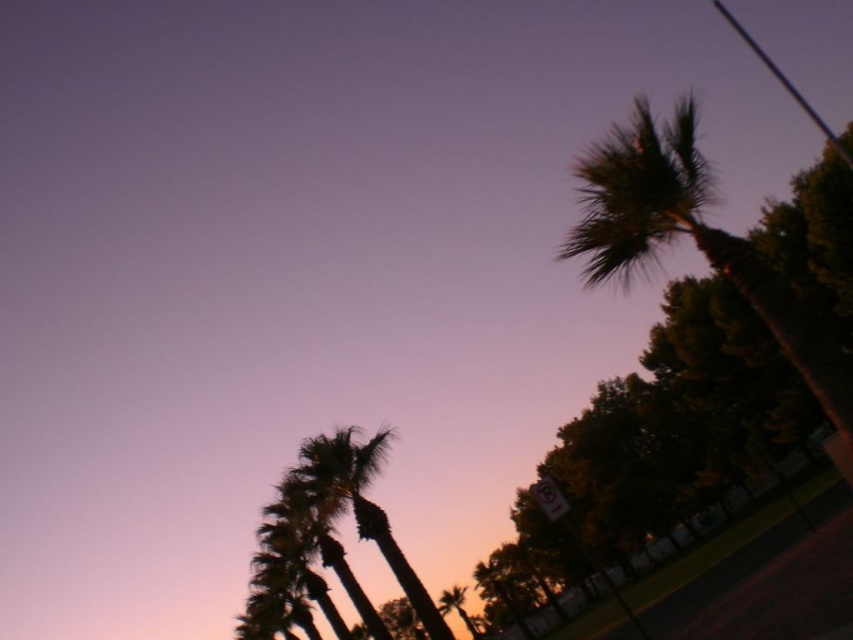
Does dark green leafy palm tree at upper right have a greater width compared to silhouette leafy palm at lower left?

Yes.

In the scene shown: Between dark green leafy palm tree at upper right and silhouette leafy palm at lower left, which one is positioned lower?

silhouette leafy palm at lower left is below.

Which is behind, point (602, 144) or point (302, 451)?

The point (302, 451) is behind.

Find the location of a particular element. dark green leafy palm tree at upper right is located at coordinates (689, 237).